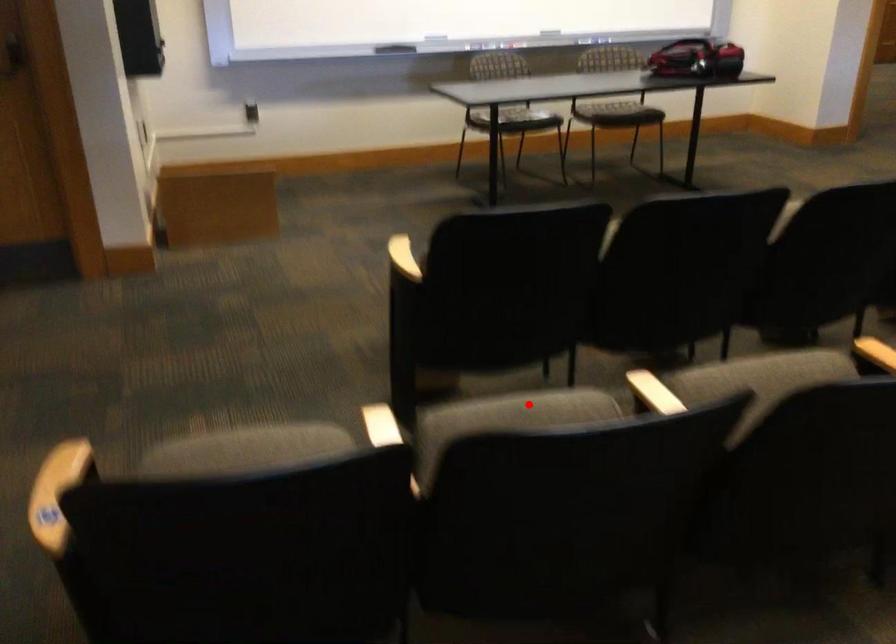
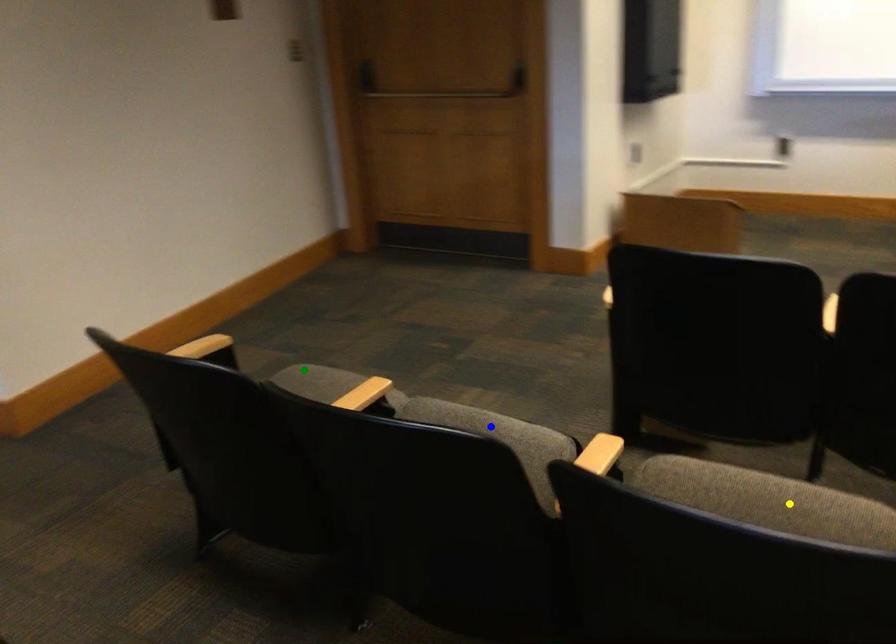
Question: I am providing you with two images of the same scene from different viewpoints. A red point is marked on the first image. You are given multiple points on the second image. In image 2, which mark is for the same physical point as the one in image 1?

Choices:
 (A) yellow point
 (B) green point
 (C) blue point

Answer: (C)